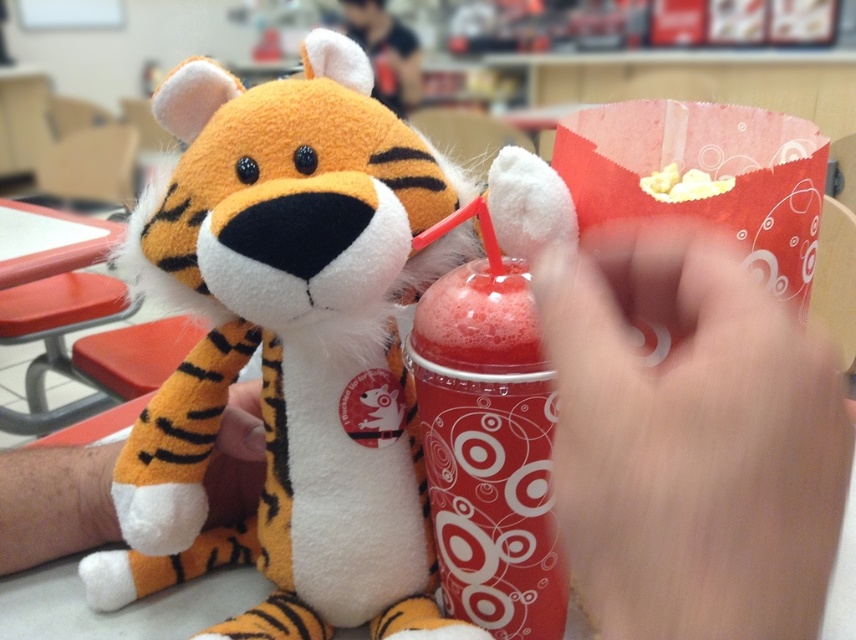
Can you confirm if soft plush tiger at center is positioned below yellow popcorn at upper center?

Indeed, soft plush tiger at center is positioned under yellow popcorn at upper center.

Based on the photo, who is more forward, (385, 529) or (716, 193)?

Point (716, 193) is more forward.

Find the location of a particular element. The height and width of the screenshot is (640, 856). soft plush tiger at center is located at coordinates (288, 349).

Does point (435, 321) lie in front of point (675, 173)?

Yes.

The height and width of the screenshot is (640, 856). Find the location of `translucent plastic cup at center`. translucent plastic cup at center is located at coordinates (489, 451).

Between point (496, 397) and point (702, 188), which one is positioned behind?

The point (702, 188) is behind.

Locate an element on the screen. translucent plastic cup at center is located at coordinates (489, 451).

This screenshot has height=640, width=856. Describe the element at coordinates (385, 52) in the screenshot. I see `dark blue shirt at upper center` at that location.

Is dark blue shirt at upper center bigger than yellow popcorn at upper center?

Correct, dark blue shirt at upper center is larger in size than yellow popcorn at upper center.

Who is more distant from viewer, (x=382, y=33) or (x=658, y=182)?

The point (x=382, y=33) is more distant.

This screenshot has width=856, height=640. Find the location of `dark blue shirt at upper center`. dark blue shirt at upper center is located at coordinates (385, 52).